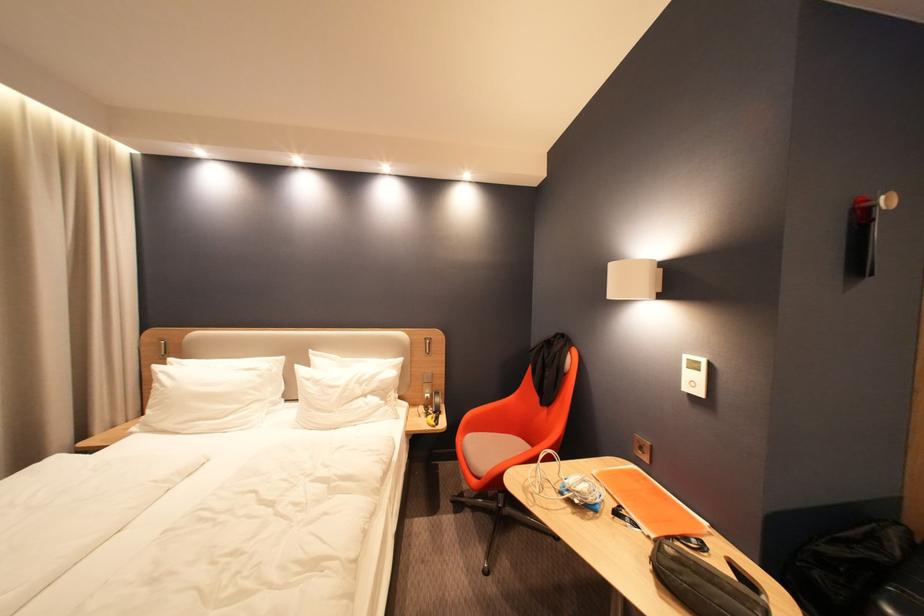
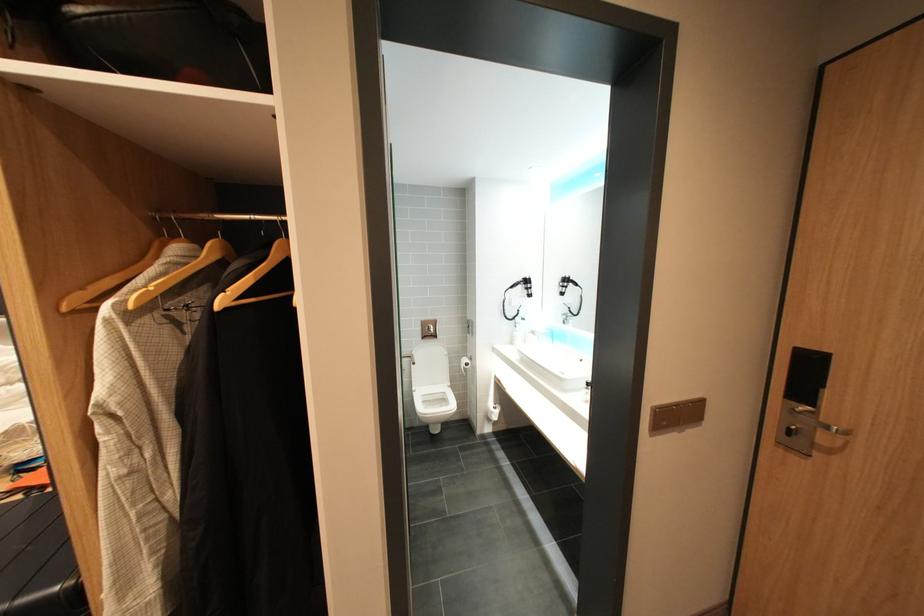
Question: In a continuous first-person perspective shot, in which direction is the camera moving?

Choices:
 (A) Left
 (B) Right
 (C) Forward
 (D) Backward

Answer: (B)